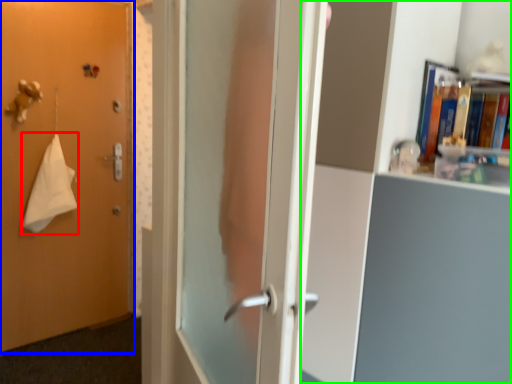
Question: Considering the real-world distances, which object is farthest from bath towel (highlighted by a red box)? door (highlighted by a blue box) or bookcase (highlighted by a green box)?

Choices:
 (A) door
 (B) bookcase

Answer: (B)